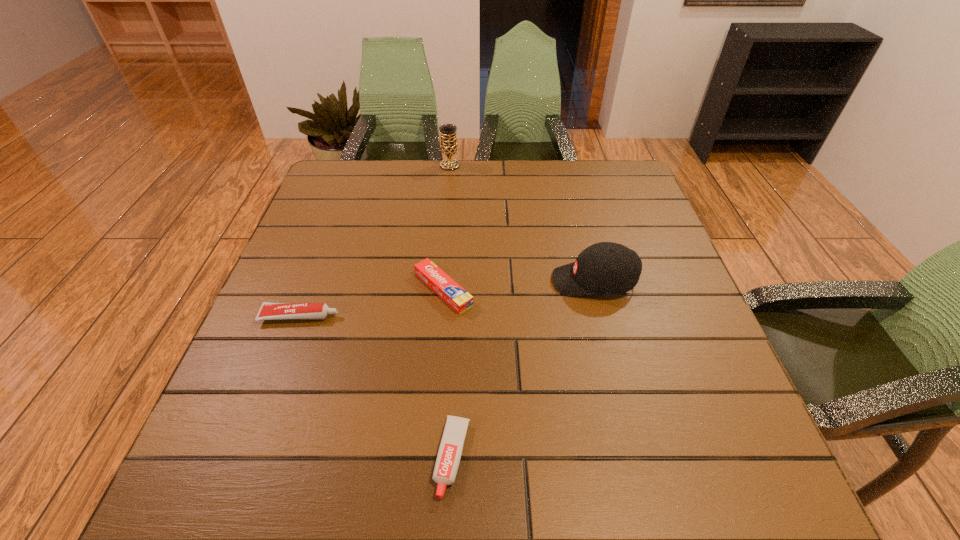
Identify the location of the tallest object. This screenshot has width=960, height=540. (448, 146).

Image resolution: width=960 pixels, height=540 pixels. What are the coordinates of `the farthest object` in the screenshot? It's located at (448, 146).

Identify the location of the rightmost object. This screenshot has height=540, width=960. (608, 268).

Locate an element on the screen. The width and height of the screenshot is (960, 540). baseball cap is located at coordinates (608, 268).

Locate an element on the screen. the leftmost toothpaste is located at coordinates (268, 311).

The height and width of the screenshot is (540, 960). I want to click on the nearest toothpaste, so click(451, 446).

Where is `blank space located 0.100m on the left of the chalice`? The height and width of the screenshot is (540, 960). blank space located 0.100m on the left of the chalice is located at coordinates (408, 165).

In order to click on vacant space located with a logo on the front of the second tallest object in this screenshot , I will do `click(385, 281)`.

Identify the location of free space located with a logo on the front of the second tallest object. (488, 281).

The image size is (960, 540). I want to click on vacant space located with a logo on the front of the second tallest object, so click(x=420, y=281).